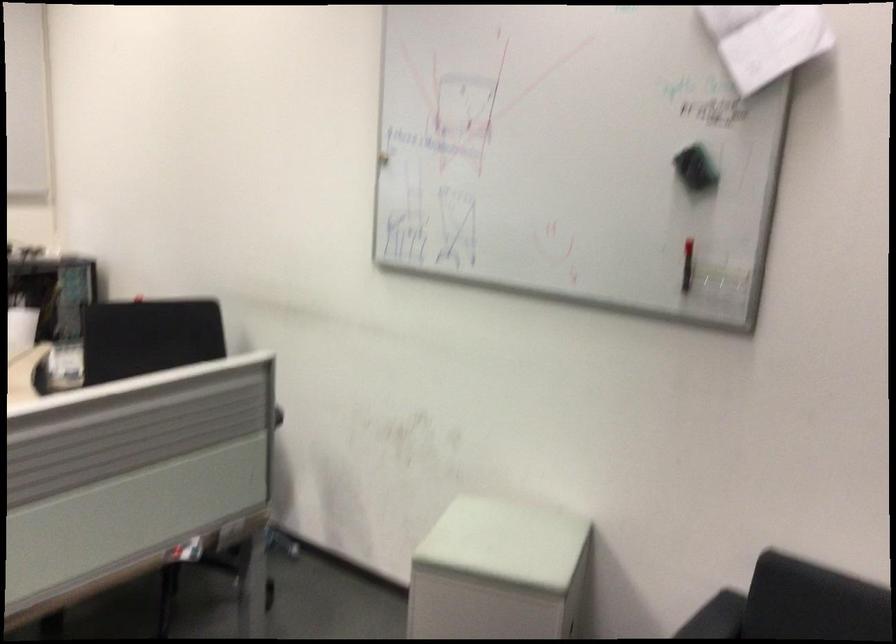
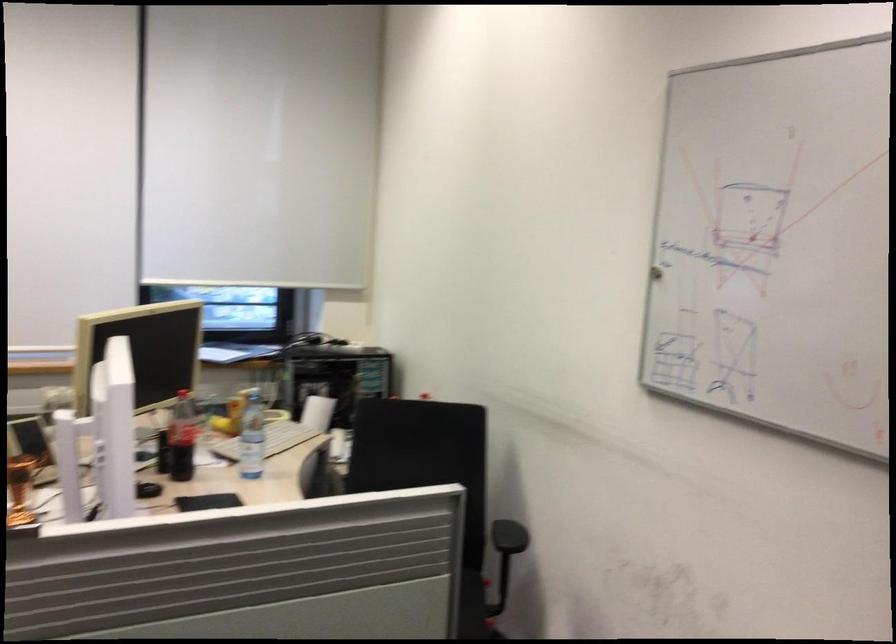
What movement of the cameraman would produce the second image?

The movement direction of the cameraman is right, forward.